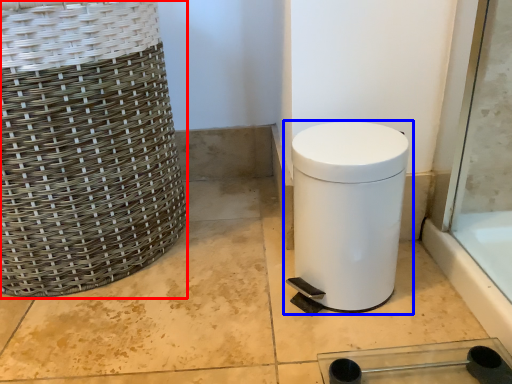
Question: Among these objects, which one is farthest to the camera, basket (highlighted by a red box) or waste container (highlighted by a blue box)?

Choices:
 (A) basket
 (B) waste container

Answer: (B)